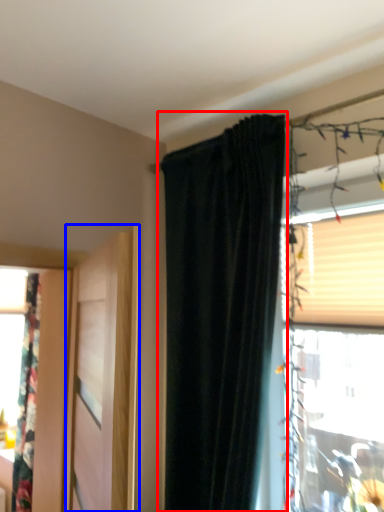
Question: Among these objects, which one is farthest to the camera, curtain (highlighted by a red box) or door (highlighted by a blue box)?

Choices:
 (A) curtain
 (B) door

Answer: (A)